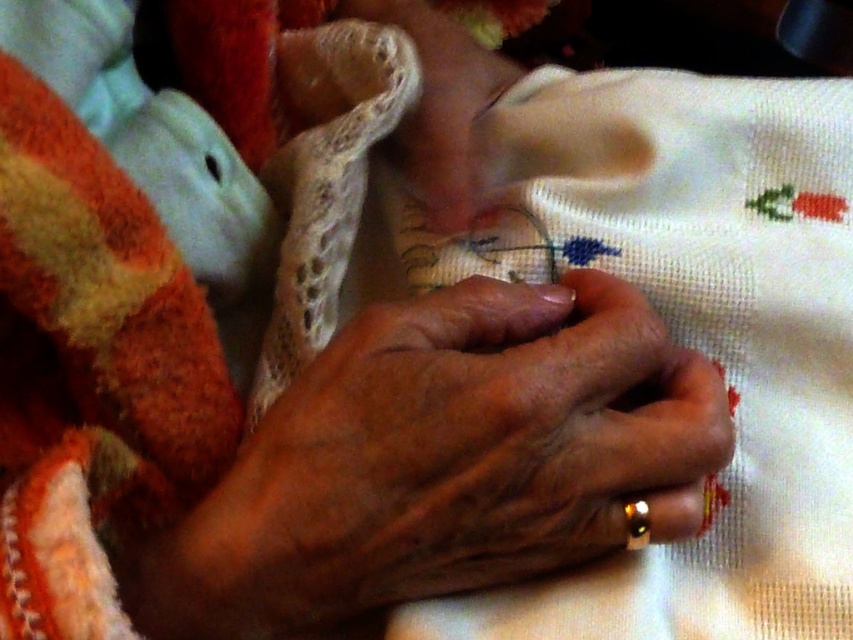
You are a photographer adjusting the focus on your camera. The camera is currently focused on the point at coordinates (445, 460). Based on the scene description, what object is the camera focused on?

The camera is focused on the smooth skin hands at center, as the point (445, 460) is located on them.

You are an artist sketching the scene and need to decide the proportions. Which of the two hands, the smooth skin hands at center or the smooth beige hand at center, should you draw wider in your sketch?

The smooth skin hands at center should be drawn wider because its width is larger than the smooth beige hand at center according to the description.

Looking at the scene, which hand is positioned to the left between the smooth skin hands at center and the smooth beige hand at center?

The smooth skin hands at center is positioned to the left of the smooth beige hand at center.